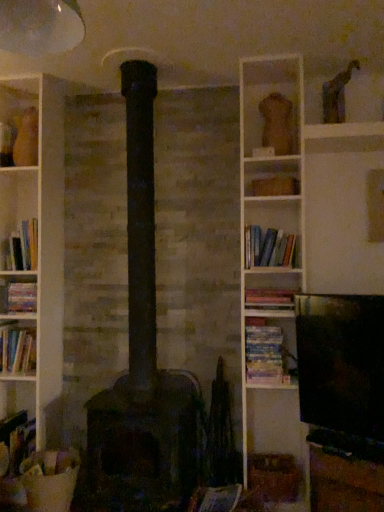
Find the location of a particular element. matte pink book at center, the third book from the bottom is located at coordinates (269, 298).

Locate an element on the screen. hardcover book at lower left, the 1th book viewed from the left is located at coordinates (17, 440).

This screenshot has width=384, height=512. Describe the element at coordinates (18, 297) in the screenshot. I see `hardcover book at left, acting as the 4th book starting from the right` at that location.

You are a GUI agent. You are given a task and a screenshot of the screen. Output one action in this format:
    pyautogui.click(x=<x>, y=<y>)
    Task: Click on the hardcover books at left, the fifth book positioned from the right
    This screenshot has height=512, width=384.
    Given the screenshot: What is the action you would take?
    pyautogui.click(x=22, y=247)

Could you measure the distance between hardcover book at lower left, the 6th book when ordered from right to left, and dark gray stone stove at center?

hardcover book at lower left, the 6th book when ordered from right to left, is 25.23 inches from dark gray stone stove at center.

Can you see hardcover book at lower left, which ranks as the first book in bottom-to-top order, touching dark gray stone stove at center?

hardcover book at lower left, which ranks as the first book in bottom-to-top order, is not next to dark gray stone stove at center, and they're not touching.

Between hardcover book at lower left, the 1th book viewed from the left, and dark gray stone stove at center, which one has larger width?

hardcover book at lower left, the 1th book viewed from the left.

Considering the relative sizes of hardcover book at lower left, which ranks as the first book in bottom-to-top order, and dark gray stone stove at center in the image provided, is hardcover book at lower left, which ranks as the first book in bottom-to-top order, bigger than dark gray stone stove at center?

Incorrect, hardcover book at lower left, which ranks as the first book in bottom-to-top order, is not larger than dark gray stone stove at center.

Considering the sizes of objects hardcover book at left, the third book positioned from the left, and wooden at center, which is the first shelf in bottom-to-top order, in the image provided, who is shorter, hardcover book at left, the third book positioned from the left, or wooden at center, which is the first shelf in bottom-to-top order,?

hardcover book at left, the third book positioned from the left, is shorter.

Considering the positions of objects hardcover book at left, which appears as the 3th book when viewed from the top, and wooden at center, marked as the second shelf in a left-to-right arrangement, in the image provided, who is more to the right, hardcover book at left, which appears as the 3th book when viewed from the top, or wooden at center, marked as the second shelf in a left-to-right arrangement,?

From the viewer's perspective, wooden at center, marked as the second shelf in a left-to-right arrangement, appears more on the right side.

Considering the positions of point (31, 288) and point (369, 465), is point (31, 288) closer or farther from the camera than point (369, 465)?

Point (31, 288) is positioned farther from the camera compared to point (369, 465).

Is hardcover book at left, acting as the 4th book starting from the right, wider or thinner than wooden at center, marked as the second shelf in a left-to-right arrangement?

Clearly, hardcover book at left, acting as the 4th book starting from the right, has less width compared to wooden at center, marked as the second shelf in a left-to-right arrangement.

Considering the relative sizes of hardcover books at center-right, acting as the fourth book starting from the left, and hardcover book at left, acting as the fourth book starting from the bottom, in the image provided, is hardcover books at center-right, acting as the fourth book starting from the left, smaller than hardcover book at left, acting as the fourth book starting from the bottom,?

Incorrect, hardcover books at center-right, acting as the fourth book starting from the left, is not smaller in size than hardcover book at left, acting as the fourth book starting from the bottom.

Locate an element on the screen. the 4th book behind the hardcover books at center-right, the 5th book in the top-to-bottom sequence is located at coordinates (18, 297).

Does hardcover book at lower left, which ranks as the first book in bottom-to-top order, have a larger size compared to hardcover books at center-right, the third book positioned from the right?

Indeed, hardcover book at lower left, which ranks as the first book in bottom-to-top order, has a larger size compared to hardcover books at center-right, the third book positioned from the right.

Can we say hardcover book at lower left, which ranks as the first book in bottom-to-top order, lies outside hardcover books at center-right, the 5th book in the top-to-bottom sequence?

Yes, hardcover book at lower left, which ranks as the first book in bottom-to-top order, is outside of hardcover books at center-right, the 5th book in the top-to-bottom sequence.

From the picture: Is hardcover books at center-right, the 5th book in the top-to-bottom sequence, at the back of hardcover book at lower left, the 6th book when ordered from right to left?

That's not correct — hardcover book at lower left, the 6th book when ordered from right to left, is not looking away from hardcover books at center-right, the 5th book in the top-to-bottom sequence.

Starting from the hardcover books at center-right, the 5th book in the top-to-bottom sequence, which book is the 3rd one behind? Please provide its 2D coordinates.

[(17, 440)]

Which of these two, hardcover book at lower left, the 6th book when ordered from right to left, or hardcover book at left, the third book positioned from the left, is thinner?

hardcover book at left, the third book positioned from the left, is thinner.

This screenshot has width=384, height=512. What are the coordinates of `book that is the 3rd object located above the hardcover book at lower left, the 6th book when ordered from right to left (from the image's perspective)` in the screenshot? It's located at (18, 297).

Considering the positions of objects hardcover book at lower left, the 1th book viewed from the left, and hardcover book at left, acting as the 4th book starting from the right, in the image provided, who is more to the right, hardcover book at lower left, the 1th book viewed from the left, or hardcover book at left, acting as the 4th book starting from the right,?

Positioned to the right is hardcover book at left, acting as the 4th book starting from the right.

Choose the correct answer: Is hardcover book at left, which appears as the 3th book when viewed from the top, inside matte pink book at center, marked as the first book in a right-to-left arrangement, or outside it?

The correct answer is: outside.

Is hardcover book at left, which appears as the 3th book when viewed from the top, oriented towards matte pink book at center, the third book from the bottom?

No, hardcover book at left, which appears as the 3th book when viewed from the top, is not facing towards matte pink book at center, the third book from the bottom.

Looking at the image, does hardcover book at left, the third book positioned from the left, seem bigger or smaller compared to matte pink book at center, marked as the 6th book in a left-to-right arrangement?

In the image, hardcover book at left, the third book positioned from the left, appears to be smaller than matte pink book at center, marked as the 6th book in a left-to-right arrangement.

Considering the points (31, 289) and (249, 295), which point is in front, point (31, 289) or point (249, 295)?

The point (249, 295) is closer to the camera.

Does hardcover book at lower left, which ranks as the first book in bottom-to-top order, have a greater height compared to hardcover books at center-right, arranged as the fifth book when ordered from the bottom?

Yes.

From a real-world perspective, relative to hardcover books at center-right, which is the fifth book from left to right, is hardcover book at lower left, which ranks as the first book in bottom-to-top order, vertically above or below?

hardcover book at lower left, which ranks as the first book in bottom-to-top order, is situated lower than hardcover books at center-right, which is the fifth book from left to right, in the real world.

What's the angular difference between hardcover book at lower left, the 6th book when ordered from right to left, and hardcover books at center-right, placed as the second book when sorted from right to left,'s facing directions?

The facing directions of hardcover book at lower left, the 6th book when ordered from right to left, and hardcover books at center-right, placed as the second book when sorted from right to left, are 0.187 degrees apart.

Looking at the image, does hardcover book at lower left, which ranks as the first book in bottom-to-top order, seem bigger or smaller compared to hardcover books at center-right, arranged as the fifth book when ordered from the bottom?

Considering their sizes, hardcover book at lower left, which ranks as the first book in bottom-to-top order, takes up more space than hardcover books at center-right, arranged as the fifth book when ordered from the bottom.

At what (x,y) coordinates should I click in order to perform the action: click on book that is the 3rd one when counting leftward from the dark gray stone stove at center. Please return your answer as a coordinate pair (x, y). Image resolution: width=384 pixels, height=512 pixels. Looking at the image, I should click on (17, 440).

I want to click on shelf below the hardcover book at left, which appears as the 3th book when viewed from the top (from a real-world perspective), so click(x=344, y=483).

Based on their spatial positions, is hardcover book at left, acting as the 4th book starting from the right, or dark gray stone stove at center closer to hardcover books at center-right, the 2th book ordered from the bottom?

dark gray stone stove at center is closer to hardcover books at center-right, the 2th book ordered from the bottom.

When comparing their distances from wooden at center, the first shelf from the right, does wooden box at upper center, placed as the second shelf when sorted from right to left, or matte pink book at center, marked as the first book in a right-to-left arrangement, seem closer?

matte pink book at center, marked as the first book in a right-to-left arrangement, lies closer to wooden at center, the first shelf from the right, than the other object.

When comparing their distances from matte pink book at center, positioned as the 4th book in top-to-bottom order, does hardcover book at lower left, the 6th book when ordered from right to left, or dark gray stone stove at center seem closer?

dark gray stone stove at center is closer to matte pink book at center, positioned as the 4th book in top-to-bottom order.

Based on their spatial positions, is dark gray stone stove at center or hardcover book at lower left, which ranks as the first book in bottom-to-top order, further from matte pink book at center, positioned as the 4th book in top-to-bottom order?

hardcover book at lower left, which ranks as the first book in bottom-to-top order, lies further to matte pink book at center, positioned as the 4th book in top-to-bottom order, than the other object.

Looking at the image, which one is located further to hardcover books at center-right, the 5th book in the top-to-bottom sequence, wooden box at upper center, placed as the second shelf when sorted from right to left, or hardcover book at left, which appears as the 3th book when viewed from the top?

hardcover book at left, which appears as the 3th book when viewed from the top, is further to hardcover books at center-right, the 5th book in the top-to-bottom sequence.

Based on their spatial positions, is hardcover book at left, acting as the 4th book starting from the right, or dark gray stone stove at center closer to hardcover book at lower left, which ranks as the first book in bottom-to-top order?

dark gray stone stove at center is positioned closer to the anchor hardcover book at lower left, which ranks as the first book in bottom-to-top order.

Estimate the real-world distances between objects in this image. Which object is closer to hardcover books at center-right, which is the fifth book from left to right, hardcover books at center-right, acting as the fourth book starting from the left, or wooden box at upper center, the 1th shelf in the top-to-bottom sequence?

wooden box at upper center, the 1th shelf in the top-to-bottom sequence, is closer to hardcover books at center-right, which is the fifth book from left to right.

Which object lies further to the anchor point wooden at center, which is the first shelf in bottom-to-top order, matte pink book at center, marked as the 6th book in a left-to-right arrangement, or hardcover book at lower left, which ranks as the first book in bottom-to-top order?

hardcover book at lower left, which ranks as the first book in bottom-to-top order, is further to wooden at center, which is the first shelf in bottom-to-top order.

You are a GUI agent. You are given a task and a screenshot of the screen. Output one action in this format:
    pyautogui.click(x=<x>, y=<y>)
    Task: Click on the stove between hardcover books at left, the fifth book positioned from the right, and wooden at center, the first shelf from the right, in the horizontal direction
    
    Given the screenshot: What is the action you would take?
    pyautogui.click(x=145, y=444)

Locate an element on the screen. shelf between hardcover book at left, acting as the fourth book starting from the bottom, and matte pink book at center, the third book from the bottom is located at coordinates (272, 177).

Find the location of a particular element. Image resolution: width=384 pixels, height=512 pixels. stove situated between hardcover books at left, positioned as the first book in top-to-bottom order, and hardcover books at center-right, placed as the second book when sorted from right to left, from left to right is located at coordinates (x=145, y=444).

Locate an element on the screen. Image resolution: width=384 pixels, height=512 pixels. stove between hardcover books at left, the 2th book in the left-to-right sequence, and matte pink book at center, marked as the first book in a right-to-left arrangement, in the horizontal direction is located at coordinates (145, 444).